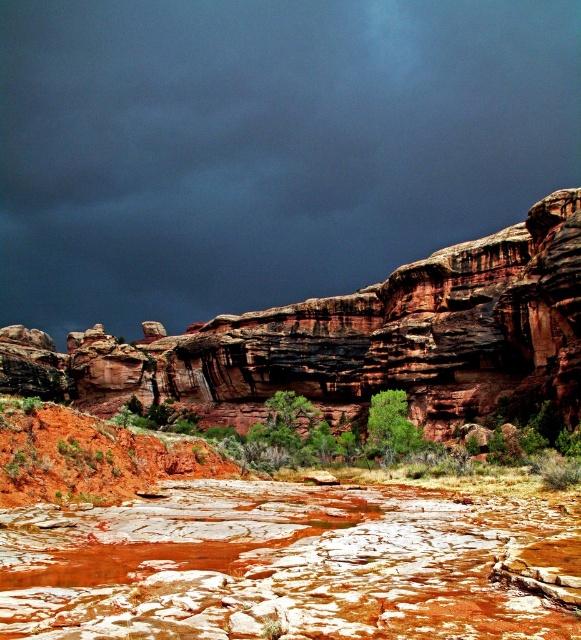
Describe the element at coordinates (289, 563) in the screenshot. I see `rustic stone riverbed at center` at that location.

Can you confirm if rustic stone riverbed at center is taller than rustic sandstone cliff at center?

In fact, rustic stone riverbed at center may be shorter than rustic sandstone cliff at center.

Between point (156, 576) and point (487, 292), which one is positioned behind?

Point (487, 292)

At what (x,y) coordinates should I click in order to perform the action: click on rustic stone riverbed at center. Please return your answer as a coordinate pair (x, y). The height and width of the screenshot is (640, 581). Looking at the image, I should click on (289, 563).

Locate an element on the screen. The height and width of the screenshot is (640, 581). dark gray cloud at upper center is located at coordinates (264, 147).

Is point (92, 218) positioned before point (250, 570)?

No, it is not.

Identify the location of dark gray cloud at upper center. This screenshot has width=581, height=640. (264, 147).

Can you confirm if dark gray cloud at upper center is shorter than rustic sandstone cliff at center?

In fact, dark gray cloud at upper center may be taller than rustic sandstone cliff at center.

Which of these two, dark gray cloud at upper center or rustic sandstone cliff at center, stands taller?

dark gray cloud at upper center is taller.

Image resolution: width=581 pixels, height=640 pixels. I want to click on dark gray cloud at upper center, so click(264, 147).